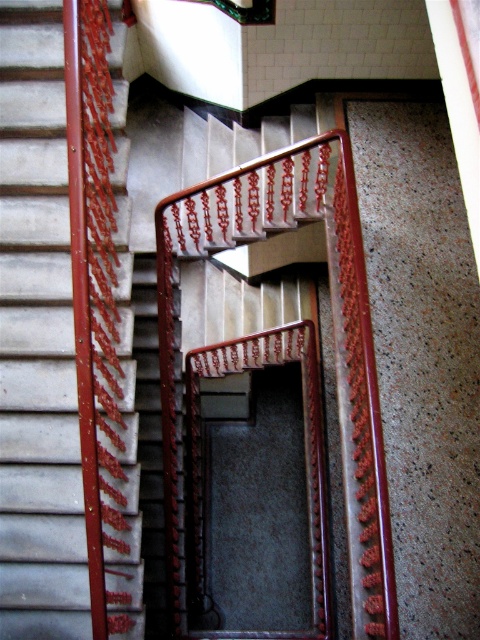
Which is in front, point (120, 228) or point (348, 234)?

Point (120, 228) is more forward.

Is metallic red handrail at left taller than polished wood handrail at center?

Indeed, metallic red handrail at left has a greater height compared to polished wood handrail at center.

Describe the element at coordinates (37, 340) in the screenshot. This screenshot has height=640, width=480. I see `metallic red handrail at left` at that location.

The height and width of the screenshot is (640, 480). Find the location of `metallic red handrail at left`. metallic red handrail at left is located at coordinates (37, 340).